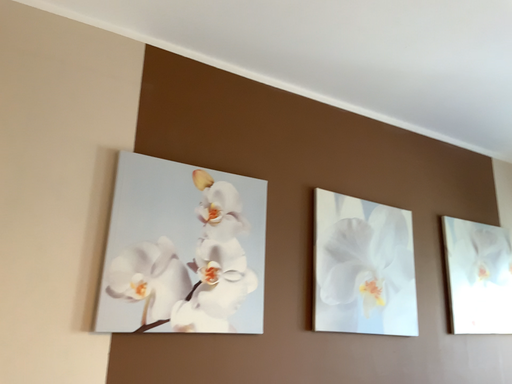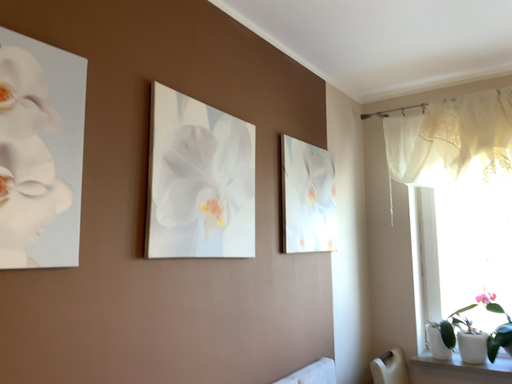
Question: Which way did the camera rotate in the video?

Choices:
 (A) rotated right
 (B) rotated left

Answer: (A)